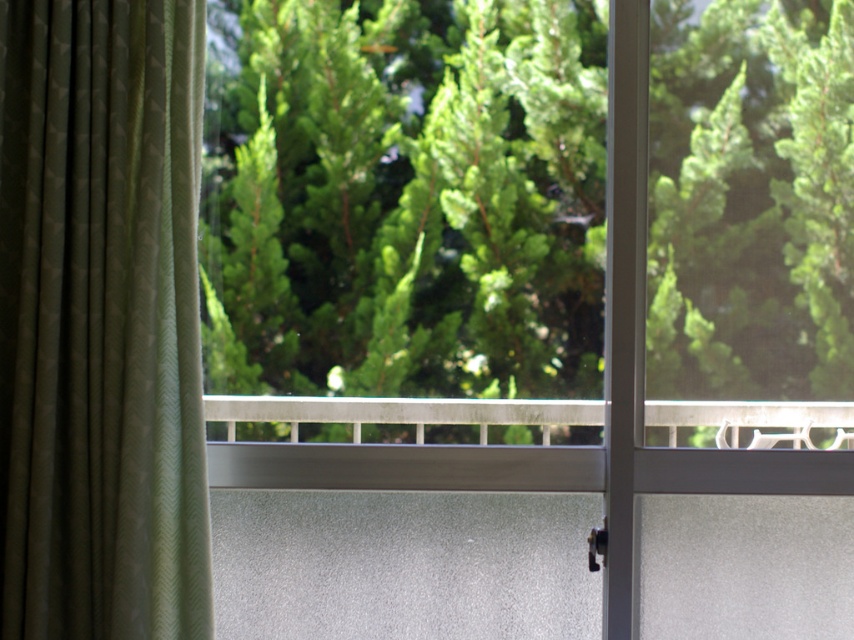
You are standing inside a room and looking through the window. You see the green leafy tree at upper center and the satin silver rail at center. Which object is closer to you?

The green leafy tree at upper center is closer to you because the satin silver rail at center is behind it.

You are standing at the camera position looking through the window. There is a green leafy tree at upper center outside. If you want to take a closer look at the tree, should you move forward or backward from your current position?

The green leafy tree at upper center and camera are 8.03 feet apart from each other. To get a closer look, you should move forward towards the tree to reduce the distance between yourself and the tree.

Looking at this image, you are standing inside a room and notice the green textured curtain at left and the satin silver rail at center. Which object is closer to the left side of the room?

The green textured curtain at left is closer to the left side of the room because it is positioned to the left of the satin silver rail at center.